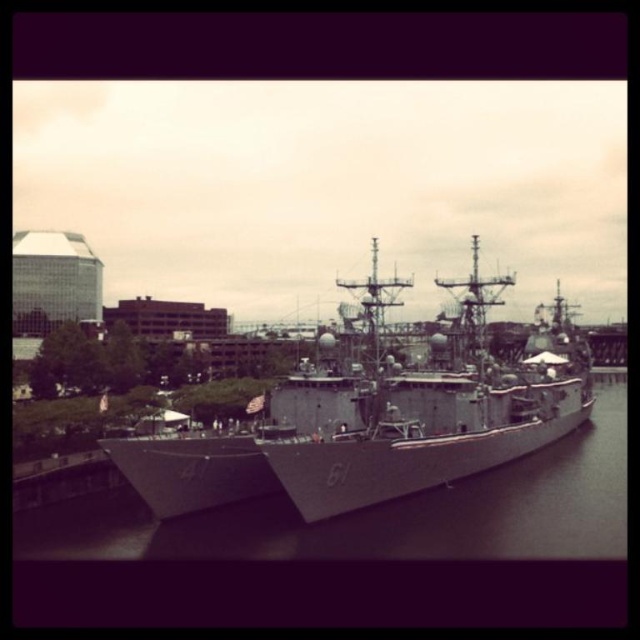
Does point (442, 413) lie behind point (620, 548)?

Yes, it is.

Who is more forward, (563, 429) or (168, 556)?

Point (168, 556) is more forward.

I want to click on gray metallic ship at center, so click(x=426, y=403).